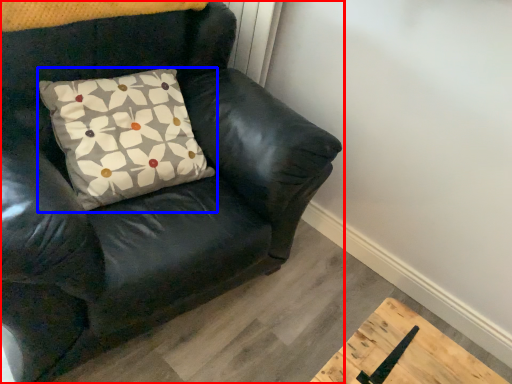
Question: Which object is closer to the camera taking this photo, chair (highlighted by a red box) or pillow (highlighted by a blue box)?

Choices:
 (A) chair
 (B) pillow

Answer: (A)